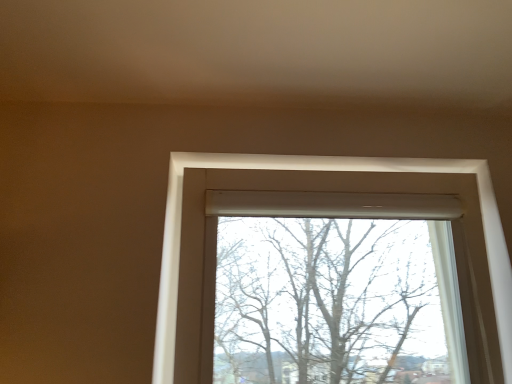
What do you see at coordinates (327, 171) in the screenshot? I see `white matte window at center` at bounding box center [327, 171].

Find the location of `white matte window at center`. white matte window at center is located at coordinates (327, 171).

What is the approximate height of white matte window at center?

58.26 centimeters.

Find the location of `white matte window at center`. white matte window at center is located at coordinates (327, 171).